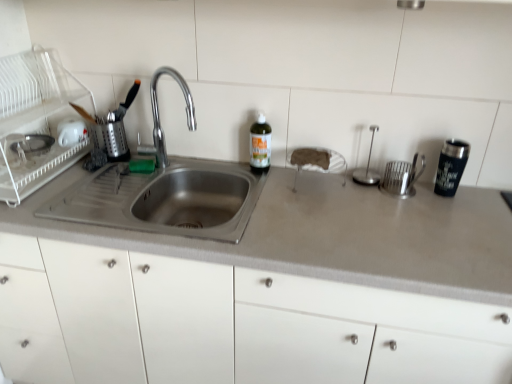
This screenshot has height=384, width=512. In order to click on vacant space situated on the left part of green glass bottle at center in this screenshot , I will do tap(225, 168).